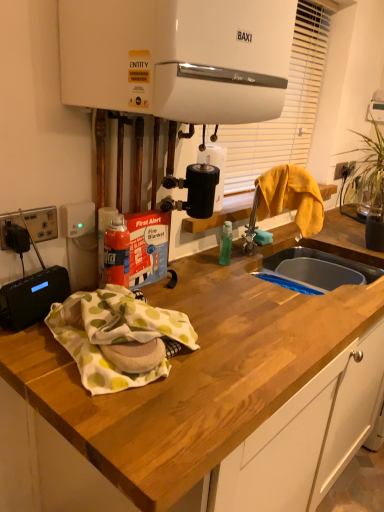
Where is `free space below green leafy plant at right (from a real-world perspective)`? This screenshot has height=512, width=384. free space below green leafy plant at right (from a real-world perspective) is located at coordinates (365, 241).